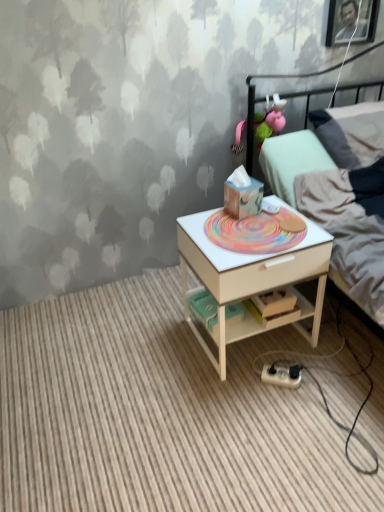
You are a GUI agent. You are given a task and a screenshot of the screen. Output one action in this format:
    pyautogui.click(x=<x>, y=<y>)
    Task: Click on the vacant region in front of white plastic power strip at lower center
    The height and width of the screenshot is (512, 384).
    Given the screenshot: What is the action you would take?
    pyautogui.click(x=289, y=414)